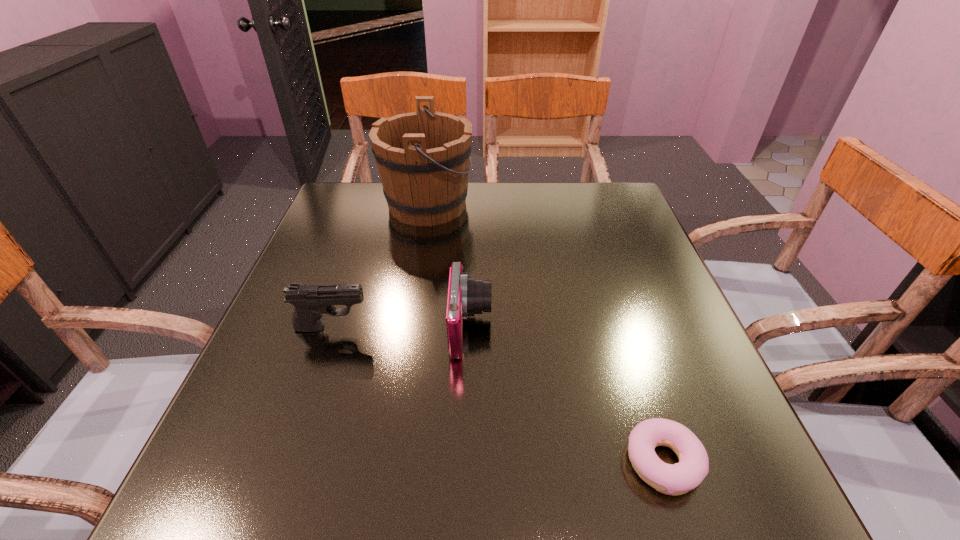
The height and width of the screenshot is (540, 960). I want to click on empty location between the shortest object and the pistol, so click(x=497, y=395).

This screenshot has height=540, width=960. In order to click on vacant area between the camera and the pistol in this screenshot , I will do `click(401, 328)`.

Select which object appears as the second closest to the doughnut. Please provide its 2D coordinates. Your answer should be formatted as a tuple, i.e. [(x, y)], where the tuple contains the x and y coordinates of a point satisfying the conditions above.

[(310, 301)]

The height and width of the screenshot is (540, 960). I want to click on object that ranks as the closest to the camera, so click(x=310, y=301).

Where is `vacant area in the image that satisfies the following two spatial constraints: 1. on the side of the tallest object with the handle for carrying; 2. on the back side of the nearest object`? vacant area in the image that satisfies the following two spatial constraints: 1. on the side of the tallest object with the handle for carrying; 2. on the back side of the nearest object is located at coordinates (384, 462).

You are a GUI agent. You are given a task and a screenshot of the screen. Output one action in this format:
    pyautogui.click(x=<x>, y=<y>)
    Task: Click on the free space that satisfies the following two spatial constraints: 1. on the front-facing side of the camera; 2. on the left side of the shortest object
    
    Given the screenshot: What is the action you would take?
    pyautogui.click(x=468, y=462)

I want to click on blank space that satisfies the following two spatial constraints: 1. at the barrel of the shortest object; 2. on the right side of the pistol, so click(x=286, y=462).

The image size is (960, 540). I want to click on blank area in the image that satisfies the following two spatial constraints: 1. on the front-facing side of the camera; 2. on the left side of the nearest object, so click(x=468, y=462).

The height and width of the screenshot is (540, 960). In order to click on vacant space that satisfies the following two spatial constraints: 1. on the back side of the doughnut; 2. at the barrel of the pistol in this screenshot , I will do `click(619, 327)`.

This screenshot has width=960, height=540. Identify the location of vacant space that satisfies the following two spatial constraints: 1. at the barrel of the pistol; 2. on the right side of the nearest object. click(286, 462).